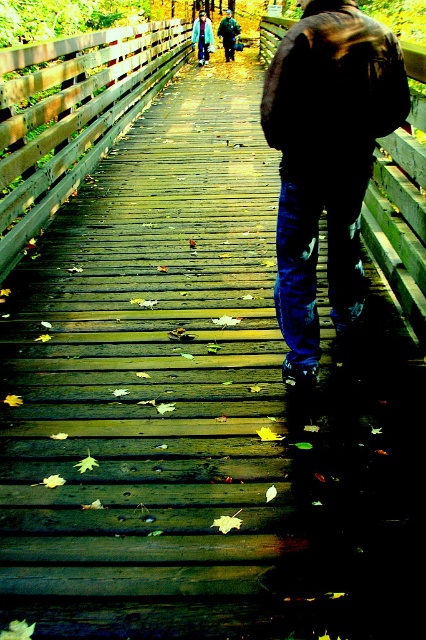
You are standing on the wooden bridge and see the point marked at coordinates (x=325, y=161). What object is located at that point?

The point at 0.255, 0.765 corresponds to the dark brown leather jacket at center.

You are standing on the wooden bridge and see both the dark brown leather jacket at center and the brushed metal jacket at upper center. Which jacket is nearer to you?

The dark brown leather jacket at center is closer to the viewer than the brushed metal jacket at upper center.

You are standing on the wooden bridge and want to hand a note to the person wearing the light blue denim jacket at upper center and the brushed metal jacket at upper center. Which jacket should you aim for first if you want to reach the closer one?

You should aim for the light blue denim jacket at upper center first because it is closer to the viewer than the brushed metal jacket at upper center.